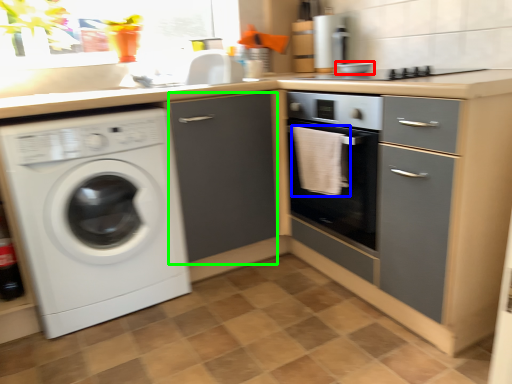
Question: Which is nearer to the appliance (highlighted by a red box)? material (highlighted by a blue box) or file cabinet (highlighted by a green box).

Choices:
 (A) material
 (B) file cabinet

Answer: (A)